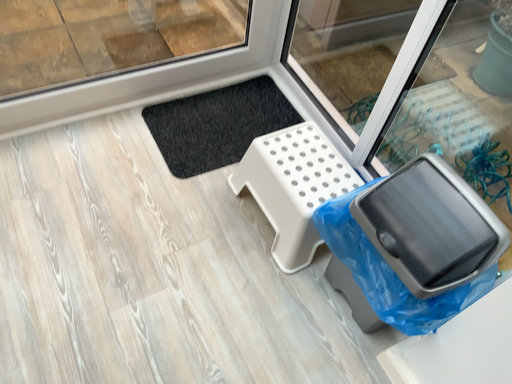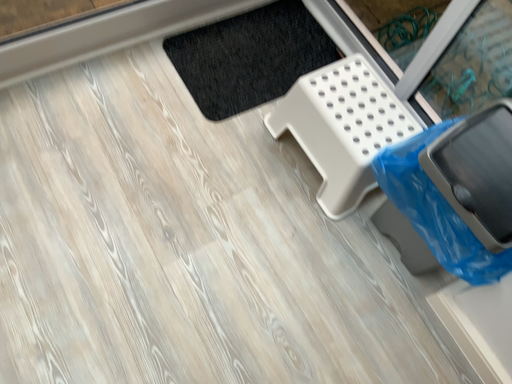
Question: How did the camera likely rotate when shooting the video?

Choices:
 (A) rotated downward
 (B) rotated upward

Answer: (A)